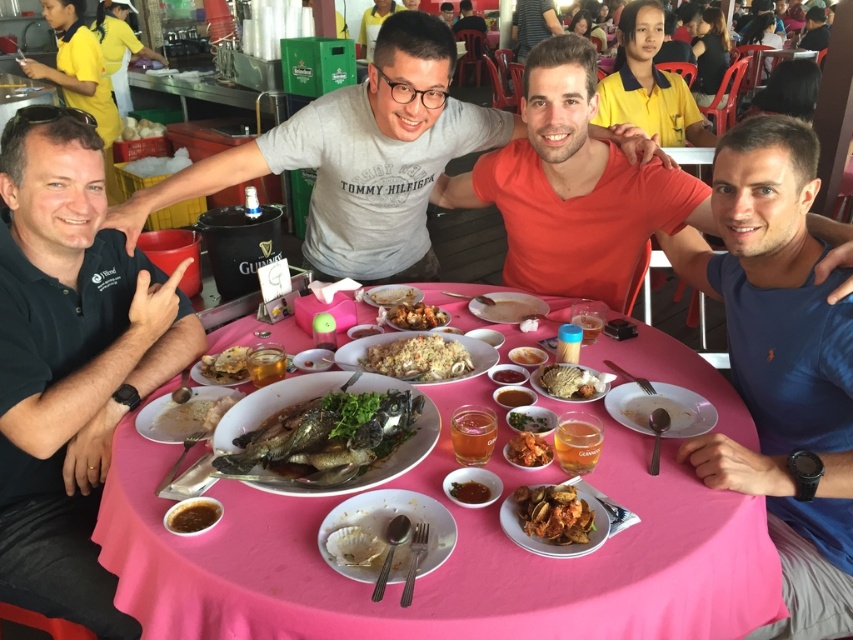
Question: Estimate the real-world distances between objects in this image. Which object is farther from the sauce matte at center?

Choices:
 (A) shiny silver fish at center
 (B) slightly browned rice at center
 (C) slightly browned bread at center

Answer: (C)

Question: Is matte white plate at lower right further to camera compared to white fluffy rice at upper left?

Choices:
 (A) no
 (B) yes

Answer: (A)

Question: Does brown matte sauce at center have a greater width compared to white creamy sauce at center?

Choices:
 (A) yes
 (B) no

Answer: (B)

Question: Which object is closer to the camera taking this photo?

Choices:
 (A) sauce matte at center
 (B) green matte shirt at left

Answer: (A)

Question: Estimate the real-world distances between objects in this image. Which object is closer to the slightly browned crispy fried chicken at center?

Choices:
 (A) orange matte shirt at center
 (B) gray cotton shirt at upper center
 (C) white fluffy rice at upper left
 (D) brown matte fried chicken at center

Answer: (D)

Question: Where is orange matte shirt at center located in relation to saucesmoothdish at center in the image?

Choices:
 (A) left
 (B) right

Answer: (B)